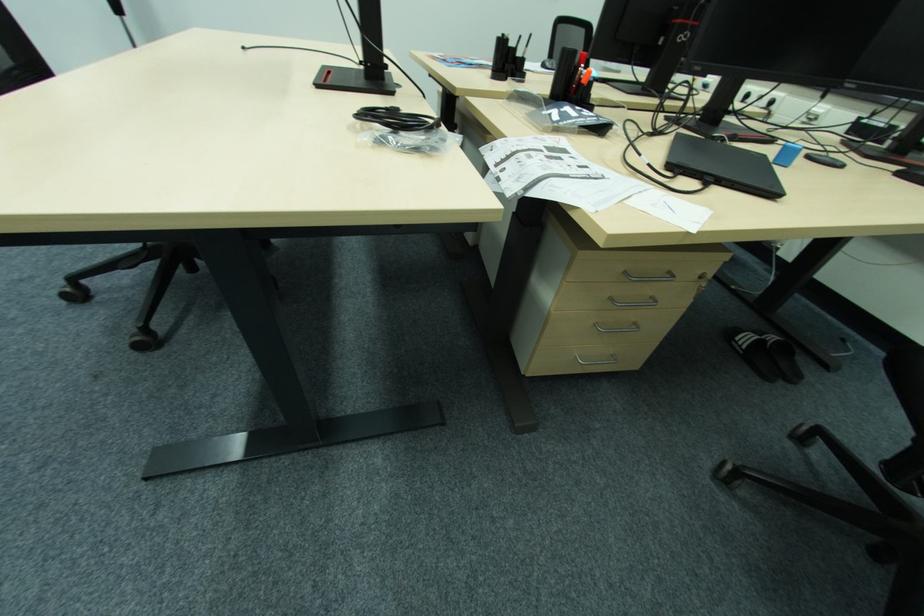
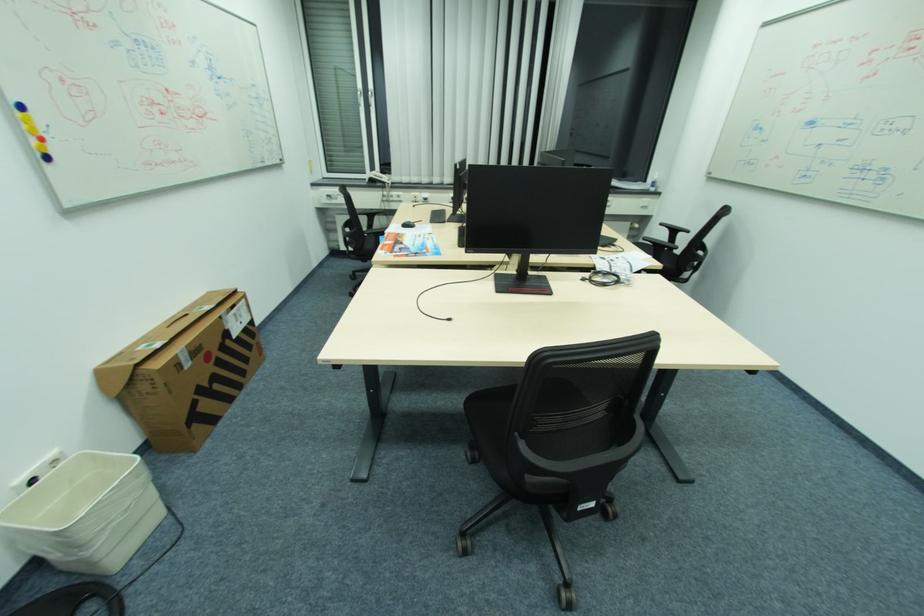
The point at (699, 232) is marked in the first image. Where is the corresponding point in the second image?

(657, 257)